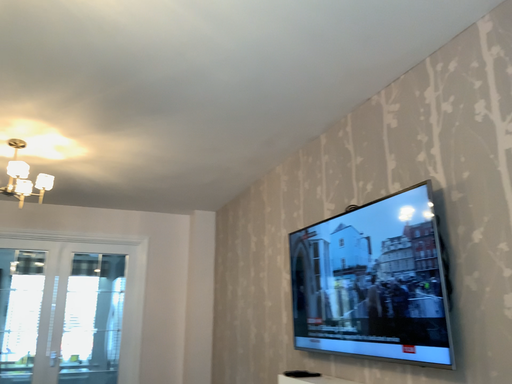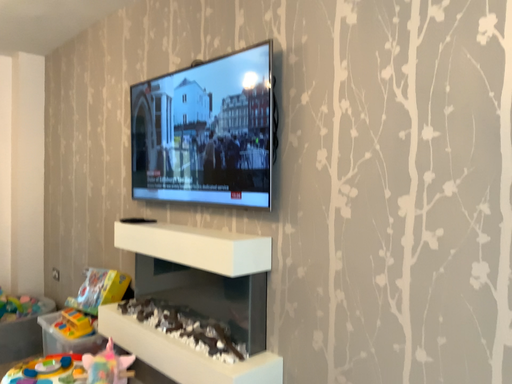
Question: How did the camera likely rotate when shooting the video?

Choices:
 (A) rotated downward
 (B) rotated upward

Answer: (A)